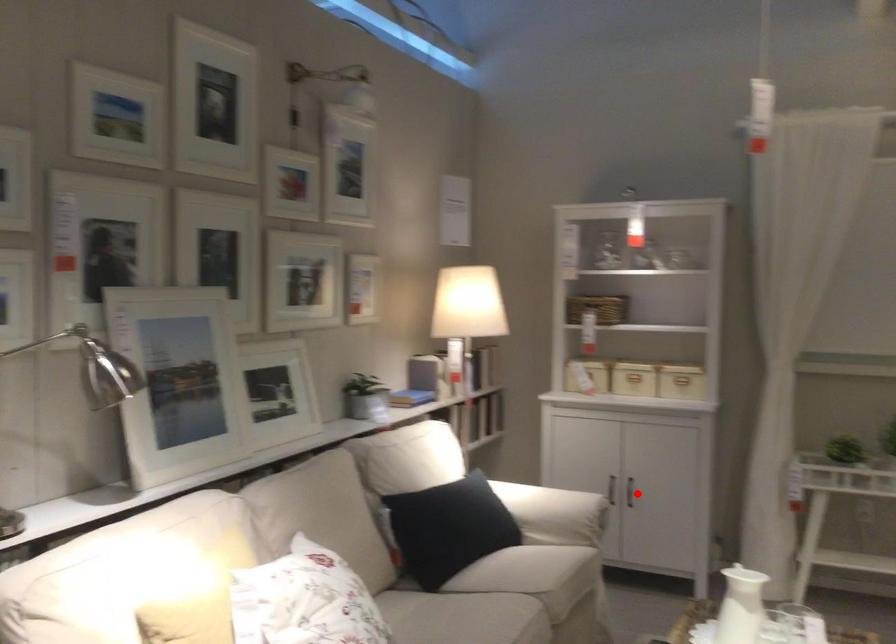
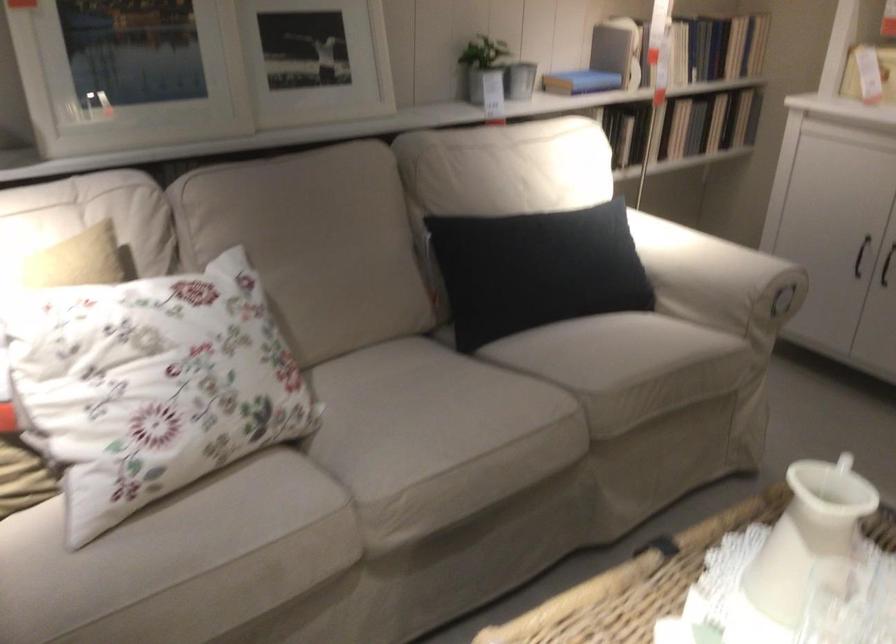
In the second image, find the point that corresponds to the highlighted location in the first image.

(886, 265)